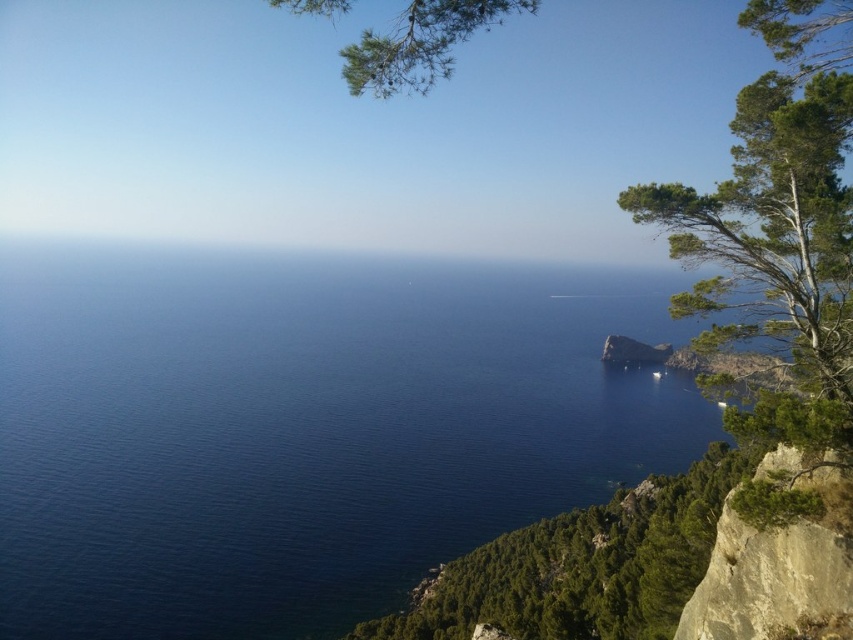
Does deep blue water at center have a greater width compared to rough textured rock at lower right?

Yes.

Is deep blue water at center behind rough textured rock at lower right?

That is True.

Who is more forward, (x=396, y=465) or (x=724, y=568)?

Point (x=724, y=568)

Locate an element on the screen. deep blue water at center is located at coordinates point(302,429).

Which is in front, point (401, 36) or point (804, 61)?

Positioned in front is point (401, 36).

Is green needle-like leaves at upper center below green textured tree at upper right?

Actually, green needle-like leaves at upper center is above green textured tree at upper right.

Is point (432, 16) closer to viewer compared to point (816, 48)?

That is True.

In order to click on green needle-like leaves at upper center in this screenshot , I will do `click(421, 44)`.

Is deep blue water at center closer to the viewer compared to green needle-like leaves at upper center?

That is False.

Can you confirm if deep blue water at center is positioned to the right of green needle-like leaves at upper center?

Yes, deep blue water at center is to the right of green needle-like leaves at upper center.

Is point (105, 310) in front of point (287, 4)?

No, (105, 310) is further to viewer.

At what (x,y) coordinates should I click in order to perform the action: click on deep blue water at center. Please return your answer as a coordinate pair (x, y). Looking at the image, I should click on (302, 429).